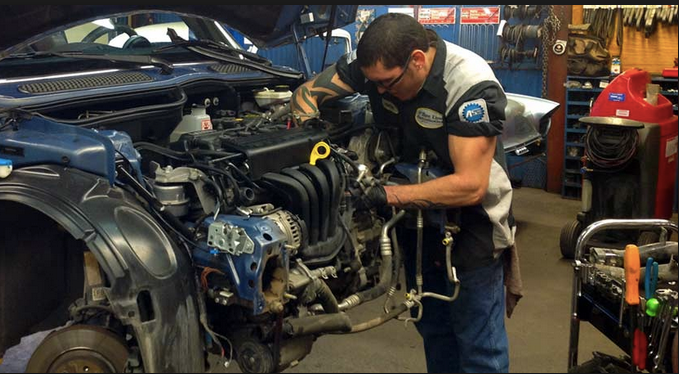
At what (x,y) coordinates should I click in order to perform the action: click on wooden wall. Please return your answer as a coordinate pair (x, y). The height and width of the screenshot is (374, 679). Looking at the image, I should click on (634, 51).